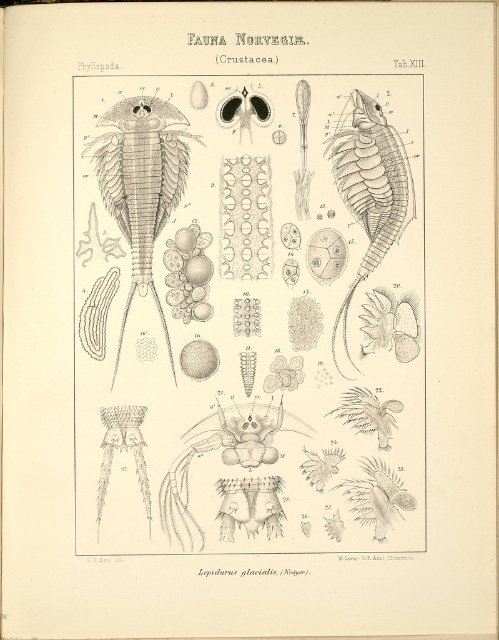
Based on the photo, what is located at the point with coordinates [142,182] in the illustration?

A grayish brown crustacean at center left is located at point [142,182].